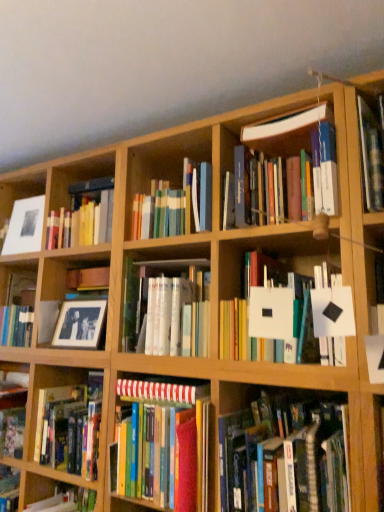
Identify the location of matte white picture frame at upper left, which is counted as the first picture frame, starting from the left. (25, 226).

What do you see at coordinates (288, 330) in the screenshot? I see `white matte paper at center, marked as the 5th book in a bottom-to-top arrangement` at bounding box center [288, 330].

Identify the location of white matte paper at center, the 2th book when ordered from top to bottom. (288, 330).

Where is `hardcover books at center, which is counted as the 1th book, starting from the bottom`? hardcover books at center, which is counted as the 1th book, starting from the bottom is located at coordinates (70, 426).

Where is `hardcover books at center, acting as the 6th book starting from the bottom`? The height and width of the screenshot is (512, 384). hardcover books at center, acting as the 6th book starting from the bottom is located at coordinates (286, 169).

This screenshot has height=512, width=384. Describe the element at coordinates (285, 454) in the screenshot. I see `hardcover book at lower right, which appears as the fourth book when viewed from the top` at that location.

Measure the distance between point (95,273) and camera.

Point (95,273) is 5.73 feet from camera.

This screenshot has width=384, height=512. Describe the element at coordinates (81, 323) in the screenshot. I see `matte black picture frame at center-left, which is the first picture frame in right-to-left order` at that location.

Locate an element on the screen. matte white picture frame at upper left, placed as the second picture frame when sorted from front to back is located at coordinates (25, 226).

Looking at this image, is hardcover books at center, which is counted as the 1th book, starting from the bottom, at the back of matte white picture frame at upper left, which appears as the 2th picture frame when ordered from the bottom?

No, matte white picture frame at upper left, which appears as the 2th picture frame when ordered from the bottom, is not facing the opposite direction of hardcover books at center, which is counted as the 1th book, starting from the bottom.

Can you confirm if matte white picture frame at upper left, marked as the 2th picture frame in a right-to-left arrangement, is wider than hardcover books at center, the sixth book from the top?

No, matte white picture frame at upper left, marked as the 2th picture frame in a right-to-left arrangement, is not wider than hardcover books at center, the sixth book from the top.

What's the angular difference between matte white picture frame at upper left, the first picture frame viewed from the back, and hardcover books at center, which is counted as the 1th book, starting from the bottom,'s facing directions?

The facing directions of matte white picture frame at upper left, the first picture frame viewed from the back, and hardcover books at center, which is counted as the 1th book, starting from the bottom, are 0.000796 degrees apart.

Does matte white picture frame at upper left, marked as the 2th picture frame in a right-to-left arrangement, come in front of hardcover books at center, the sixth book from the top?

No, it is not.

Is hardcover books at center, the sixth book from the top, facing towards matte black picture frame at center-left, which is counted as the first picture frame, starting from the bottom?

No, hardcover books at center, the sixth book from the top, is not turned towards matte black picture frame at center-left, which is counted as the first picture frame, starting from the bottom.

Is hardcover books at center, which is counted as the 1th book, starting from the bottom, surrounding matte black picture frame at center-left, marked as the 1th picture frame in a front-to-back arrangement?

No, matte black picture frame at center-left, marked as the 1th picture frame in a front-to-back arrangement, is not inside hardcover books at center, which is counted as the 1th book, starting from the bottom.

Between hardcover books at center, the sixth book from the top, and matte black picture frame at center-left, marked as the 1th picture frame in a front-to-back arrangement, which one has larger width?

Wider between the two is hardcover books at center, the sixth book from the top.

Which picture frame is the 1st one when counting from the back of the hardcover books at center, which is counted as the 1th book, starting from the bottom? Please provide its 2D coordinates.

[(81, 323)]

Looking at this image, from the image's perspective, which one is positioned lower, hardcover books at center, the sixth book from the top, or striped paper at center, positioned as the fifth book in top-to-bottom order?

hardcover books at center, the sixth book from the top, is shown below in the image.

Is hardcover books at center, the sixth book from the top, looking in the opposite direction of striped paper at center, positioned as the fifth book in top-to-bottom order?

hardcover books at center, the sixth book from the top, is not turned away from striped paper at center, positioned as the fifth book in top-to-bottom order.

Considering the relative sizes of hardcover books at center, which is counted as the 1th book, starting from the bottom, and striped paper at center, positioned as the fifth book in top-to-bottom order, in the image provided, is hardcover books at center, which is counted as the 1th book, starting from the bottom, thinner than striped paper at center, positioned as the fifth book in top-to-bottom order,?

Indeed, hardcover books at center, which is counted as the 1th book, starting from the bottom, has a lesser width compared to striped paper at center, positioned as the fifth book in top-to-bottom order.

Which is nearer, (50, 413) or (200, 416)?

Point (50, 413).

In the scene shown: Could you measure the distance between white glossy book at center, placed as the third book when sorted from top to bottom, and hardcover book at lower right, which appears as the fourth book when viewed from the top?

34.87 centimeters.

Is white glossy book at center, placed as the third book when sorted from top to bottom, turned away from hardcover book at lower right, which is counted as the 3th book, starting from the bottom?

No, white glossy book at center, placed as the third book when sorted from top to bottom,'s orientation is not away from hardcover book at lower right, which is counted as the 3th book, starting from the bottom.

Is white glossy book at center, which appears as the fourth book when ordered from the bottom, to the right of hardcover book at lower right, which appears as the fourth book when viewed from the top, from the viewer's perspective?

No.

Would you say white glossy book at center, which appears as the fourth book when ordered from the bottom, is outside hardcover book at lower right, which appears as the fourth book when viewed from the top?

Yes, white glossy book at center, which appears as the fourth book when ordered from the bottom, is outside of hardcover book at lower right, which appears as the fourth book when viewed from the top.

Measure the distance from hardcover books at center, which is counted as the 1th book, starting from the bottom, to hardcover book at lower right, which is counted as the 3th book, starting from the bottom.

The distance of hardcover books at center, which is counted as the 1th book, starting from the bottom, from hardcover book at lower right, which is counted as the 3th book, starting from the bottom, is 25.01 inches.

Does hardcover books at center, the sixth book from the top, have a lesser width compared to hardcover book at lower right, which is counted as the 3th book, starting from the bottom?

Yes, hardcover books at center, the sixth book from the top, is thinner than hardcover book at lower right, which is counted as the 3th book, starting from the bottom.

You are a GUI agent. You are given a task and a screenshot of the screen. Output one action in this format:
    pyautogui.click(x=<x>, y=<y>)
    Task: Click on the book that is the 3rd object to the left of the hardcover book at lower right, which is counted as the 3th book, starting from the bottom, starting at the anchor
    The image size is (384, 512).
    Given the screenshot: What is the action you would take?
    pyautogui.click(x=70, y=426)

Who is smaller, hardcover books at center, the sixth book from the top, or hardcover book at lower right, which is counted as the 3th book, starting from the bottom?

With smaller size is hardcover books at center, the sixth book from the top.

Considering the positions of objects hardcover books at center, the sixth book from the top, and white glossy book at center, placed as the third book when sorted from top to bottom, in the image provided, who is in front, hardcover books at center, the sixth book from the top, or white glossy book at center, placed as the third book when sorted from top to bottom,?

white glossy book at center, placed as the third book when sorted from top to bottom, is more forward.

Is white glossy book at center, which appears as the fourth book when ordered from the bottom, at the back of hardcover books at center, the sixth book from the top?

No, hardcover books at center, the sixth book from the top, is not facing away from white glossy book at center, which appears as the fourth book when ordered from the bottom.

Is hardcover books at center, the sixth book from the top, positioned far away from white glossy book at center, which appears as the fourth book when ordered from the bottom?

hardcover books at center, the sixth book from the top, is near white glossy book at center, which appears as the fourth book when ordered from the bottom, not far away.

Based on their positions, is hardcover book at lower right, which is counted as the 3th book, starting from the bottom, located to the left or right of matte black picture frame at center-left, the second picture frame in the back-to-front sequence?

hardcover book at lower right, which is counted as the 3th book, starting from the bottom, is to the right of matte black picture frame at center-left, the second picture frame in the back-to-front sequence.

Considering the sizes of hardcover book at lower right, which appears as the fourth book when viewed from the top, and matte black picture frame at center-left, which is counted as the first picture frame, starting from the bottom, in the image, is hardcover book at lower right, which appears as the fourth book when viewed from the top, wider or thinner than matte black picture frame at center-left, which is counted as the first picture frame, starting from the bottom,?

hardcover book at lower right, which appears as the fourth book when viewed from the top, is wider than matte black picture frame at center-left, which is counted as the first picture frame, starting from the bottom.

How many degrees apart are the facing directions of hardcover book at lower right, which appears as the fourth book when viewed from the top, and matte black picture frame at center-left, the second picture frame in the back-to-front sequence?

There is a 0.00238-degree angle between the facing directions of hardcover book at lower right, which appears as the fourth book when viewed from the top, and matte black picture frame at center-left, the second picture frame in the back-to-front sequence.

Considering the relative sizes of hardcover book at lower right, which is counted as the 3th book, starting from the bottom, and matte black picture frame at center-left, the second picture frame in the back-to-front sequence, in the image provided, is hardcover book at lower right, which is counted as the 3th book, starting from the bottom, shorter than matte black picture frame at center-left, the second picture frame in the back-to-front sequence,?

Incorrect, the height of hardcover book at lower right, which is counted as the 3th book, starting from the bottom, does not fall short of that of matte black picture frame at center-left, the second picture frame in the back-to-front sequence.

Where is `the 1st book to the right when counting from the matte white picture frame at upper left, the first picture frame viewed from the back`? the 1st book to the right when counting from the matte white picture frame at upper left, the first picture frame viewed from the back is located at coordinates (70, 426).

Which picture frame is the 1st one when counting from the left side of the hardcover books at center, which is counted as the 1th book, starting from the bottom? Please provide its 2D coordinates.

[(81, 323)]

Considering their positions, is striped paper at center, which appears as the 2th book when ordered from the bottom, positioned further to white glossy book at center, which appears as the fourth book when ordered from the bottom, than matte black picture frame at center-left, the second picture frame in the back-to-front sequence?

Based on the image, matte black picture frame at center-left, the second picture frame in the back-to-front sequence, appears to be further to white glossy book at center, which appears as the fourth book when ordered from the bottom.

When comparing their distances from black matte photo frame at left, does matte white picture frame at upper left, the first picture frame viewed from the back, or hardcover book at lower right, which is counted as the 3th book, starting from the bottom, seem further?

Based on the image, hardcover book at lower right, which is counted as the 3th book, starting from the bottom, appears to be further to black matte photo frame at left.

Looking at the image, which one is located further to matte black picture frame at center-left, which ranks as the 2th picture frame in top-to-bottom order, hardcover book at lower right, which is counted as the 3th book, starting from the bottom, or white glossy book at center, placed as the third book when sorted from top to bottom?

The object further to matte black picture frame at center-left, which ranks as the 2th picture frame in top-to-bottom order, is hardcover book at lower right, which is counted as the 3th book, starting from the bottom.

Considering their positions, is white matte paper at center, the 2th book when ordered from top to bottom, positioned closer to white glossy book at center, placed as the third book when sorted from top to bottom, than matte black picture frame at center-left, positioned as the second picture frame in left-to-right order?

white matte paper at center, the 2th book when ordered from top to bottom, is closer to white glossy book at center, placed as the third book when sorted from top to bottom.

From the image, which object appears to be nearer to hardcover books at center, acting as the 1th book starting from the top, white glossy book at center, placed as the third book when sorted from top to bottom, or matte white picture frame at upper left, placed as the second picture frame when sorted from front to back?

Among the two, white glossy book at center, placed as the third book when sorted from top to bottom, is located nearer to hardcover books at center, acting as the 1th book starting from the top.

When comparing their distances from striped paper at center, which appears as the 2th book when ordered from the bottom, does matte black picture frame at center-left, which ranks as the 2th picture frame in top-to-bottom order, or hardcover books at center, acting as the 1th book starting from the top, seem further?

hardcover books at center, acting as the 1th book starting from the top, lies further to striped paper at center, which appears as the 2th book when ordered from the bottom, than the other object.

When comparing their distances from white glossy book at center, placed as the third book when sorted from top to bottom, does hardcover books at center, acting as the 1th book starting from the top, or black matte photo frame at left seem further?

hardcover books at center, acting as the 1th book starting from the top, is further to white glossy book at center, placed as the third book when sorted from top to bottom.

Estimate the real-world distances between objects in this image. Which object is closer to matte white picture frame at upper left, which is counted as the first picture frame, starting from the left, black matte photo frame at left or hardcover books at center, acting as the 1th book starting from the top?

black matte photo frame at left is positioned closer to the anchor matte white picture frame at upper left, which is counted as the first picture frame, starting from the left.

You are a GUI agent. You are given a task and a screenshot of the screen. Output one action in this format:
    pyautogui.click(x=<x>, y=<y>)
    Task: Click on the book between black matte photo frame at left and striped paper at center, positioned as the fifth book in top-to-bottom order, from left to right
    The height and width of the screenshot is (512, 384).
    Given the screenshot: What is the action you would take?
    pyautogui.click(x=70, y=426)

Locate an element on the screen. Image resolution: width=384 pixels, height=512 pixels. picture frame situated between matte white picture frame at upper left, marked as the 2th picture frame in a right-to-left arrangement, and hardcover book at lower right, which appears as the fourth book when viewed from the top, from left to right is located at coordinates (81, 323).

The width and height of the screenshot is (384, 512). I want to click on picture frame located between black matte photo frame at left and hardcover book at lower right, which is counted as the 3th book, starting from the bottom, in the left-right direction, so click(x=81, y=323).

Identify the location of cabinet located between matte white picture frame at upper left, the first picture frame viewed from the back, and white glossy book at center, which appears as the fourth book when ordered from the bottom, in the left-right direction. This screenshot has height=512, width=384. (78, 293).